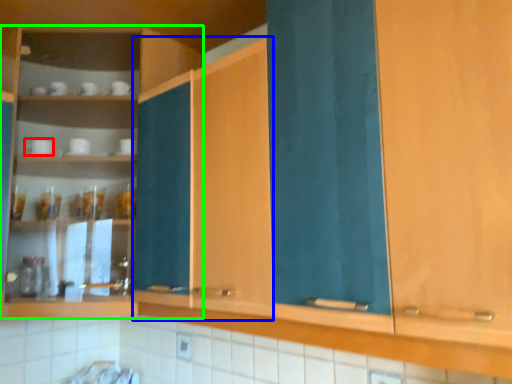
Question: Which object is the farthest from tableware (highlighted by a red box)? Choose among these: cabinetry (highlighted by a blue box) or cabinetry (highlighted by a green box).

Choices:
 (A) cabinetry
 (B) cabinetry

Answer: (A)